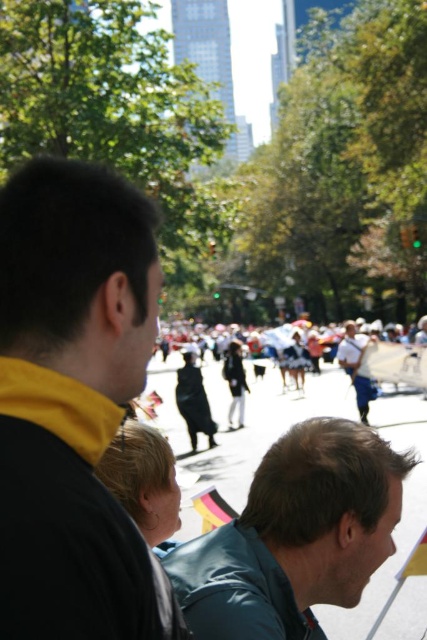
Looking at this image, you are organizing a photo shoot and need to ensure that the smooth gray jacket at lower right and the dark blue fabric at center are both visible in the frame. Given their sizes, which object should you prioritize positioning closer to the camera to ensure it doesn t get cut off?

The smooth gray jacket at lower right occupies less space than the dark blue fabric at center, so you should prioritize positioning the dark blue fabric at center closer to the camera to ensure it doesn t get cut off.

You are standing in the middle of the crowd at the lively outdoor event. You notice a smooth gray jacket at lower right. Can you tell me the exact coordinates where you see it?

The smooth gray jacket at lower right is located at coordinates point (295, 536).

You are standing in the crowd watching the parade and notice two items in the scene. The first is a black matte jacket at left, and the second is a dark blue fabric at center. Which of these two items is positioned more to the left side of the scene?

The black matte jacket at left is positioned more to the left side of the scene compared to the dark blue fabric at center.